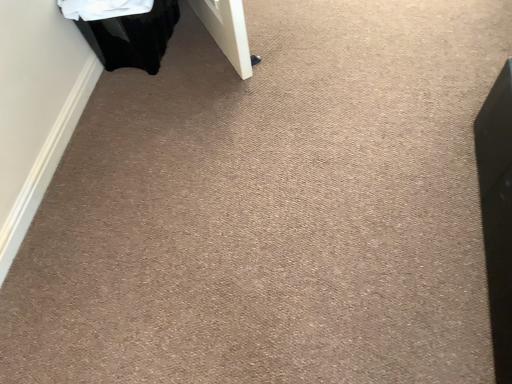
Question: Should I look upward or downward to see black glossy laundry basket at upper left?

Choices:
 (A) up
 (B) down

Answer: (A)